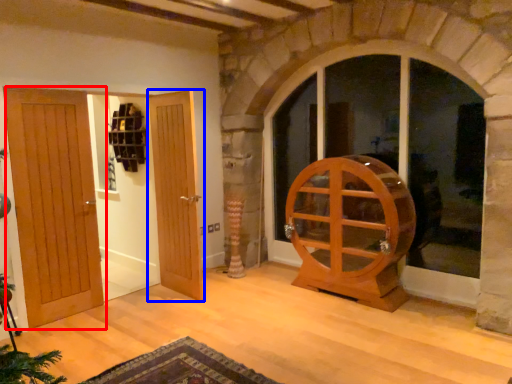
Question: Which point is closer to the camera, door (highlighted by a red box) or door (highlighted by a blue box)?

Choices:
 (A) door
 (B) door

Answer: (A)